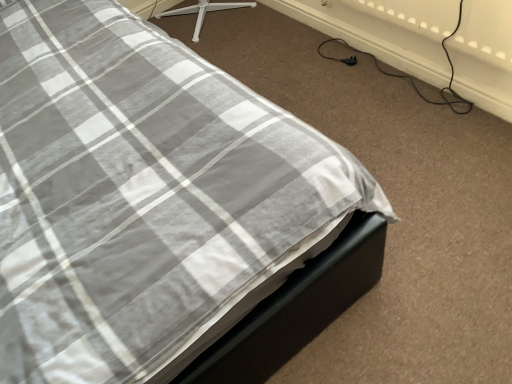
You are a GUI agent. You are given a task and a screenshot of the screen. Output one action in this format:
    pyautogui.click(x=<x>, y=<y>)
    Task: Click on the free spot in front of black plastic plug at lower right
    Image resolution: width=512 pixels, height=384 pixels.
    Given the screenshot: What is the action you would take?
    pyautogui.click(x=366, y=82)